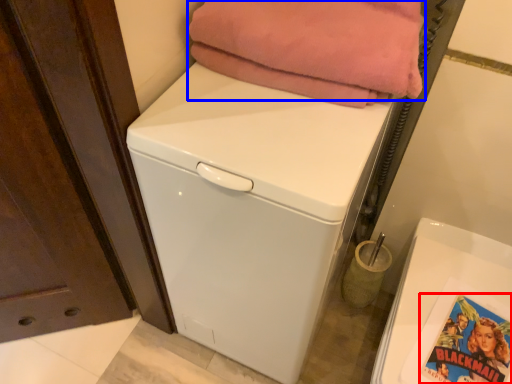
Question: Which object is further to the camera taking this photo, comic book (highlighted by a red box) or blanket (highlighted by a blue box)?

Choices:
 (A) comic book
 (B) blanket

Answer: (A)